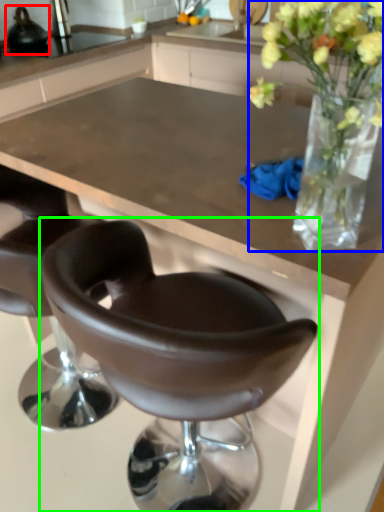
Question: Which object is positioned closest to appliance (highlighted by a red box)? Select from floral arrangement (highlighted by a blue box) and chair (highlighted by a green box).

Choices:
 (A) floral arrangement
 (B) chair

Answer: (B)